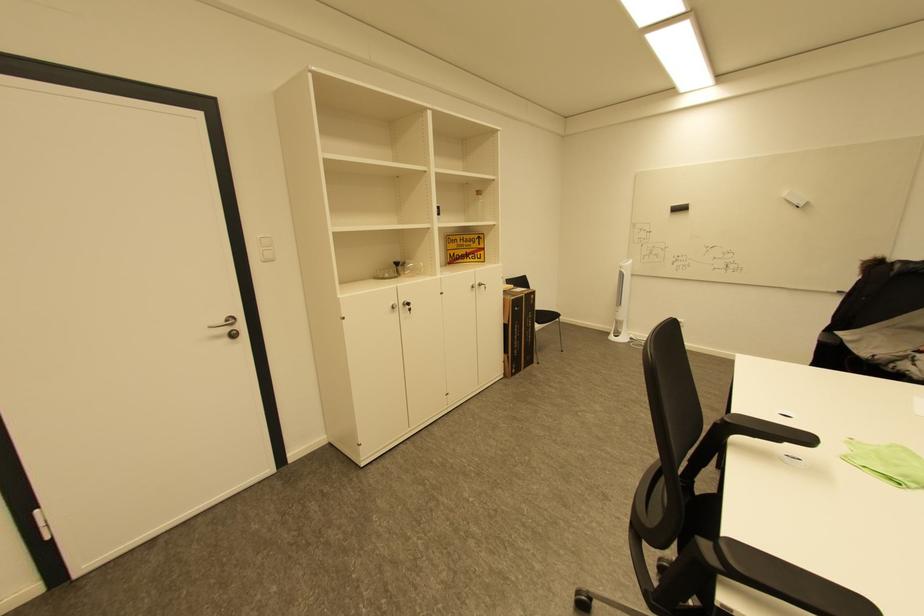
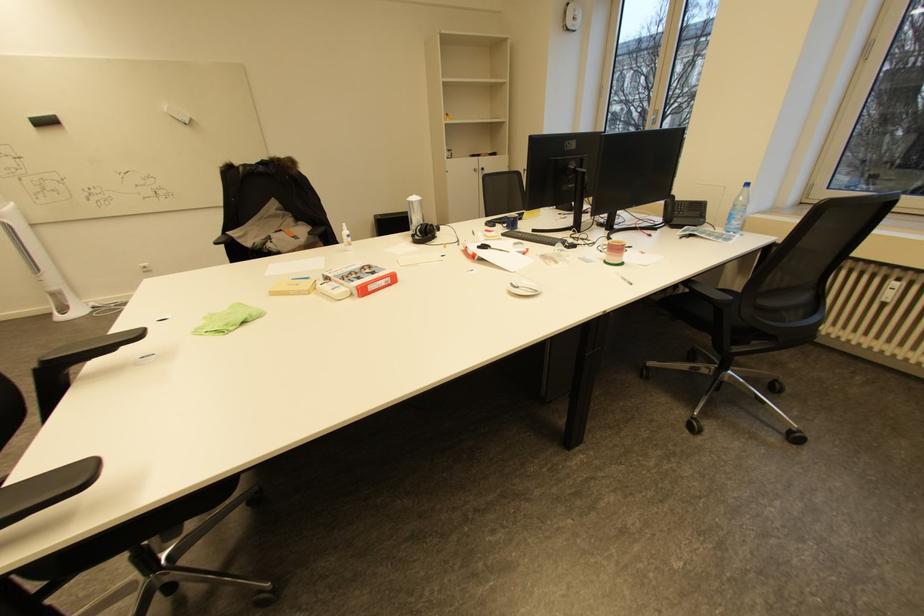
The first image is from the beginning of the video and the second image is from the end. How did the camera likely rotate when shooting the video?

The rotation direction of the camera is right-down.